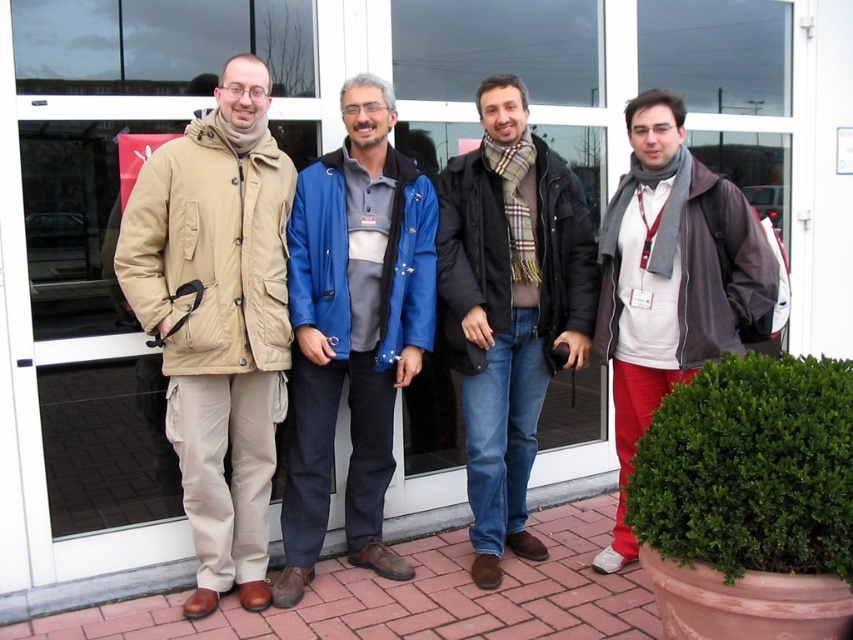
From the picture: You are standing in front of the building and want to take a photo of the beige fabric coat at left. Where should you position yourself to capture it in the center of your camera viewfinder?

To center the beige fabric coat at left in your camera viewfinder, position yourself directly in front of the beige fabric coat at left, aligning it with the center point at coordinates approximately 0.500 on the x and 0.257 on the y axis.

You are standing at point (299,268) and want to walk to the entrance of the building. Is there enough space between the men to pass through?

The men are 3.03 meters apart, so there is sufficient space to pass through between them to reach the entrance.